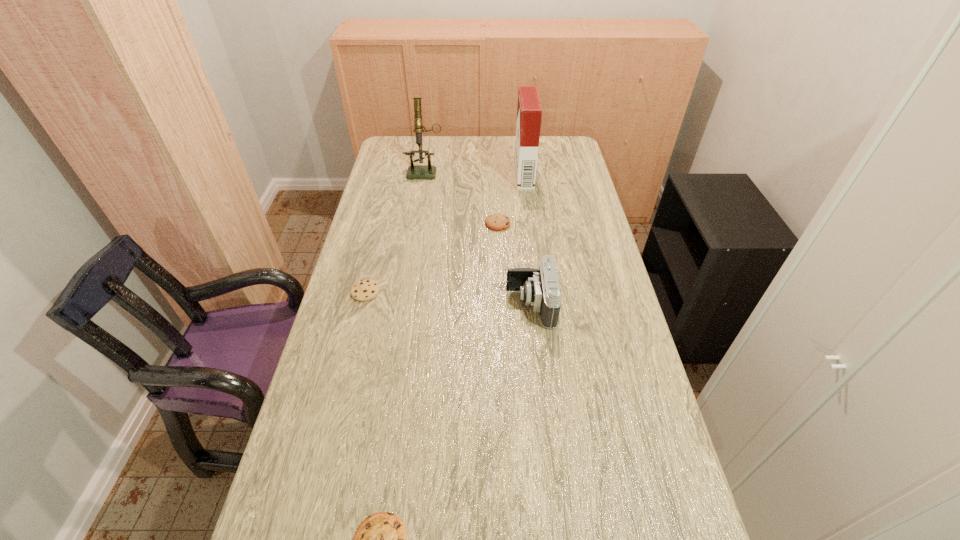
Where is `object positioned at the far left corner`? This screenshot has width=960, height=540. object positioned at the far left corner is located at coordinates (428, 171).

Where is `free spot at the far edge of the desktop`? free spot at the far edge of the desktop is located at coordinates (438, 145).

I want to click on vacant space at the left edge, so click(389, 220).

Where is `vacant point at the right edge`? This screenshot has width=960, height=540. vacant point at the right edge is located at coordinates (583, 304).

You are a GUI agent. You are given a task and a screenshot of the screen. Output one action in this format:
    pyautogui.click(x=<x>, y=<y>)
    Task: Click on the free space at the far right corner
    This screenshot has height=540, width=960.
    Given the screenshot: What is the action you would take?
    pyautogui.click(x=544, y=146)

At what (x,y) coordinates should I click in order to perform the action: click on vacant area between the camera and the leftmost object. Please return your answer as a coordinate pair (x, y). This screenshot has width=960, height=540. Looking at the image, I should click on (448, 298).

Find the location of a particular element. The width and height of the screenshot is (960, 540). vacant region between the cigarette_case and the microscope is located at coordinates pyautogui.click(x=474, y=173).

What are the coordinates of `vacant area that lies between the camera and the microscope` in the screenshot? It's located at (478, 238).

Where is `unoccupied position between the farthest cookie and the camera`? The height and width of the screenshot is (540, 960). unoccupied position between the farthest cookie and the camera is located at coordinates click(x=515, y=264).

This screenshot has height=540, width=960. I want to click on free area in between the second farthest cookie and the third farthest object, so 432,258.